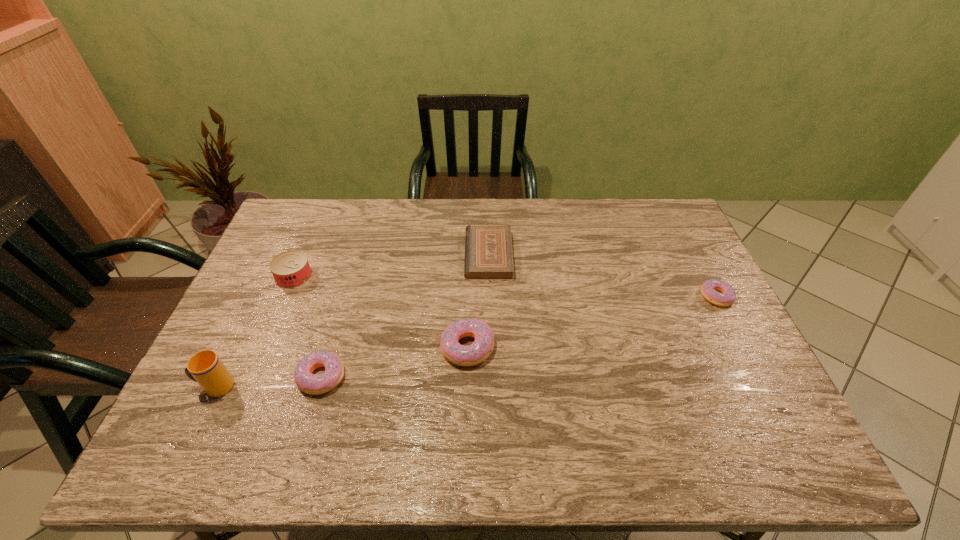
Locate an element on the screen. free location located 0.220m on the left of the shortest doughnut is located at coordinates (628, 296).

Locate an element on the screen. The width and height of the screenshot is (960, 540). free space located 0.090m on the back of the can is located at coordinates (307, 246).

Where is `vacant position located on the spine side of the Bible`? The height and width of the screenshot is (540, 960). vacant position located on the spine side of the Bible is located at coordinates (408, 255).

Locate an element on the screen. vacant region located 0.250m on the spine side of the Bible is located at coordinates (390, 255).

The image size is (960, 540). In order to click on free region located 0.190m on the spine side of the Bible in this screenshot , I will do `click(408, 255)`.

Locate an element on the screen. This screenshot has width=960, height=540. object present at the far edge is located at coordinates pos(488,248).

The height and width of the screenshot is (540, 960). In order to click on doughnut at the near edge in this screenshot , I will do `click(314, 384)`.

Find the location of a particular element. cup that is at the near edge is located at coordinates (205, 367).

The width and height of the screenshot is (960, 540). I want to click on can located in the left edge section of the desktop, so click(x=290, y=269).

Find the location of a particular element. Image resolution: width=960 pixels, height=540 pixels. cup present at the left edge is located at coordinates (205, 367).